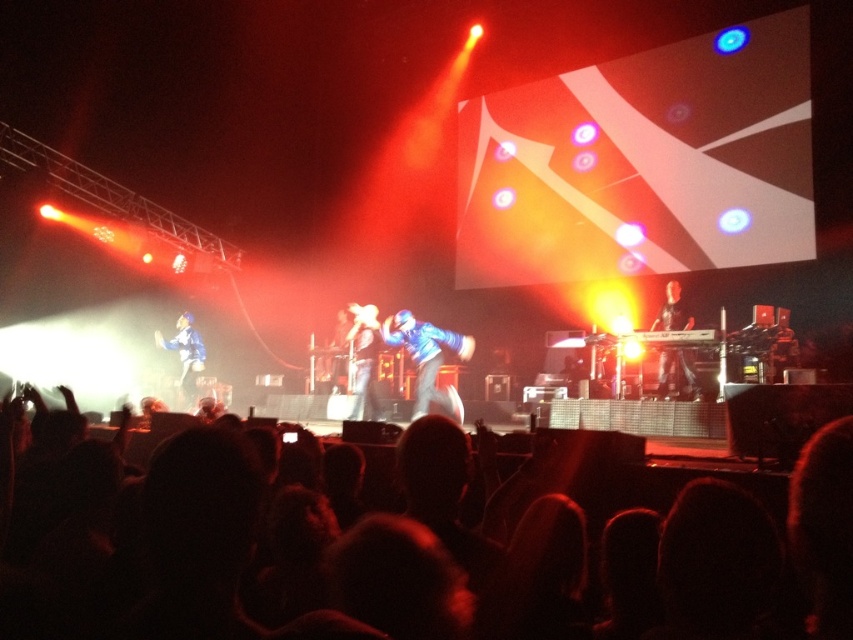
You are a photographer at the concert and want to capture both the blue fabric jacket at left and the metallic blue suit at center in a single shot. Which performer should you focus on first to ensure both are in frame?

The blue fabric jacket at left is shorter than the metallic blue suit at center, so focusing on the metallic blue suit at center first will help ensure both are visible in the frame.

Consider the image. You are a photographer at the concert and want to capture a photo of the black hair at lower center and the blue fabric jacket at left. Based on their positions, which object is located above the other?

The black hair at lower center is positioned over blue fabric jacket at left, meaning it is above the blue fabric jacket at left.